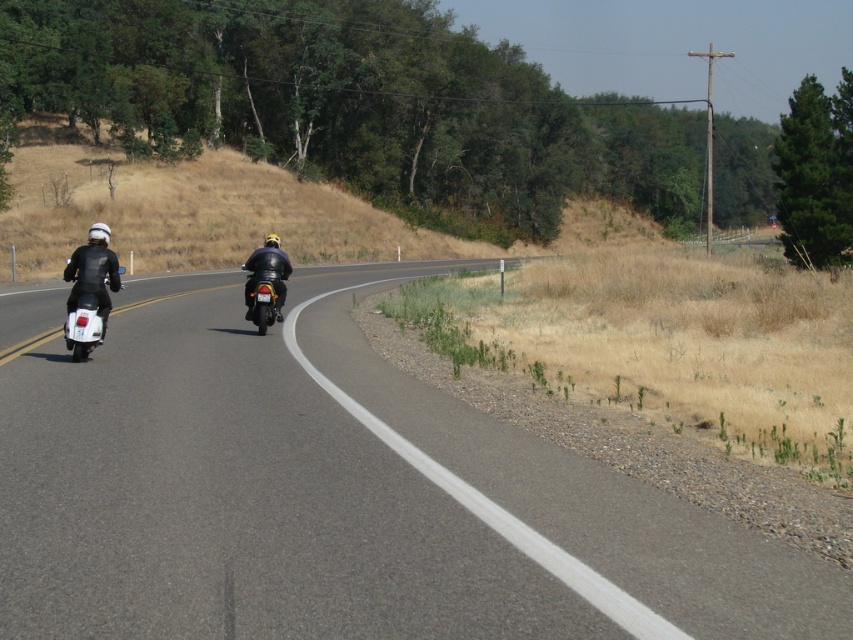
Question: Does asphalt road at center lie behind shiny black motorcycle at center?

Choices:
 (A) no
 (B) yes

Answer: (A)

Question: Which point is closer to the camera taking this photo?

Choices:
 (A) (103, 316)
 (B) (244, 264)
 (C) (756, 548)

Answer: (C)

Question: Which of the following is the farthest from the observer?

Choices:
 (A) click(67, 326)
 (B) click(260, 314)
 (C) click(91, 369)

Answer: (B)

Question: Is asphalt road at center below shiny black motorcycle at center?

Choices:
 (A) no
 (B) yes

Answer: (B)

Question: Does asphalt road at center have a larger size compared to shiny silver scooter at left?

Choices:
 (A) no
 (B) yes

Answer: (B)

Question: Among these objects, which one is nearest to the camera?

Choices:
 (A) asphalt road at center
 (B) shiny silver scooter at left
 (C) shiny black motorcycle at center

Answer: (A)